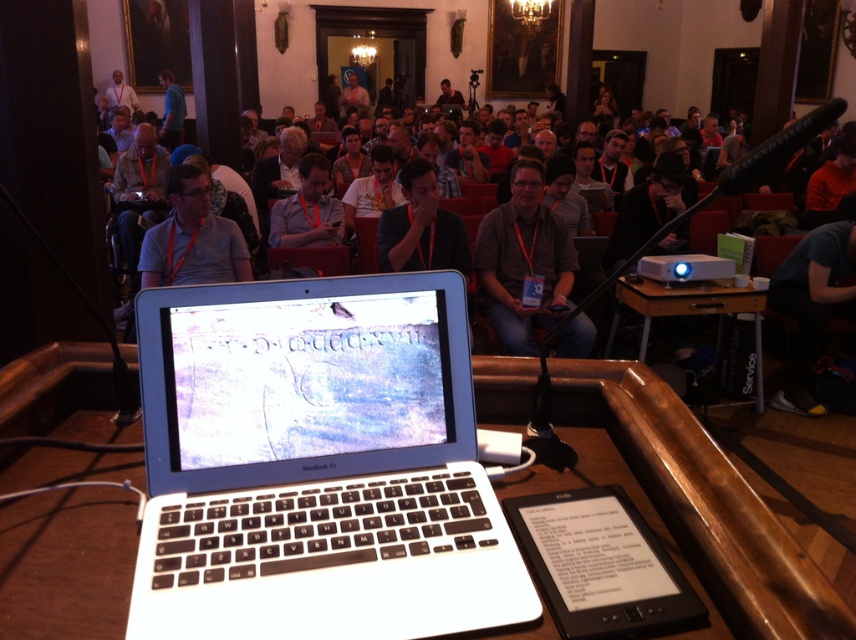
Who is taller, matte black shirt at center or wooden table at right?

With more height is wooden table at right.

At what (x,y) coordinates should I click in order to perform the action: click on matte black shirt at center. Please return your answer as a coordinate pair (x, y). The image size is (856, 640). Looking at the image, I should click on (421, 227).

Between silver/black plastic laptop at center and wooden table at right, which one has more height?

Standing taller between the two is wooden table at right.

Can you confirm if silver/black plastic laptop at center is shorter than wooden table at right?

Yes, silver/black plastic laptop at center is shorter than wooden table at right.

Is point (308, 452) farther from viewer compared to point (687, 292)?

No, (308, 452) is in front of (687, 292).

The image size is (856, 640). I want to click on silver/black plastic laptop at center, so click(316, 465).

How distant is wooden table at right from blue shirt at upper center?

They are 7.00 meters apart.

Does wooden table at right have a smaller size compared to blue shirt at upper center?

Yes, wooden table at right is smaller than blue shirt at upper center.

You are a GUI agent. You are given a task and a screenshot of the screen. Output one action in this format:
    pyautogui.click(x=<x>, y=<y>)
    Task: Click on the wooden table at right
    
    Given the screenshot: What is the action you would take?
    pyautogui.click(x=690, y=310)

The image size is (856, 640). What are the coordinates of `wooden table at right` in the screenshot? It's located at (690, 310).